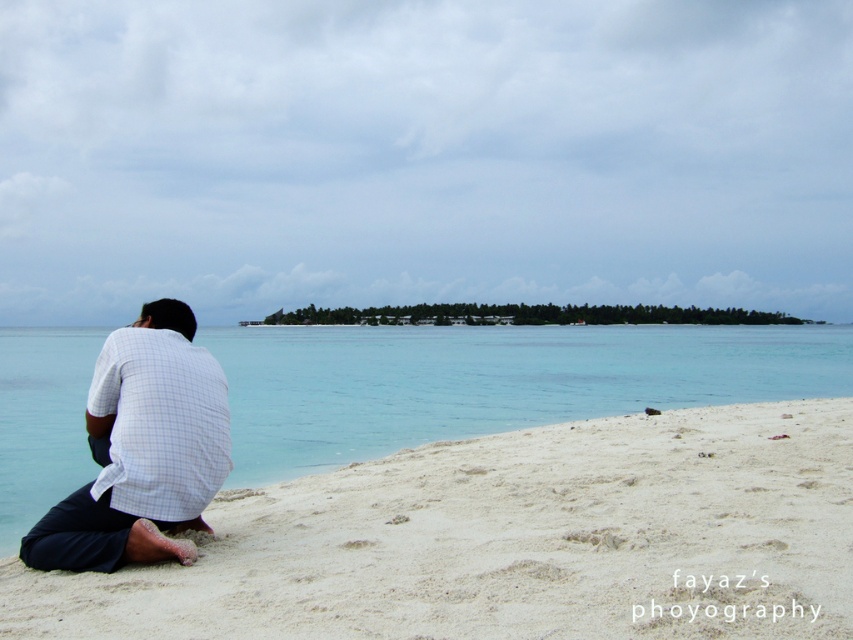
Question: Which point appears closest to the camera in this image?

Choices:
 (A) (158, 342)
 (B) (741, 634)

Answer: (B)

Question: Is white sandy beach at lower left thinner than white checkered shirt at lower left?

Choices:
 (A) no
 (B) yes

Answer: (A)

Question: Does white sandy beach at lower left appear on the right side of white checkered shirt at lower left?

Choices:
 (A) yes
 (B) no

Answer: (A)

Question: Among these points, which one is nearest to the camera?

Choices:
 (A) (440, 630)
 (B) (112, 392)

Answer: (A)

Question: Considering the relative positions of white sandy beach at lower left and white checkered shirt at lower left in the image provided, where is white sandy beach at lower left located with respect to white checkered shirt at lower left?

Choices:
 (A) left
 (B) right

Answer: (B)